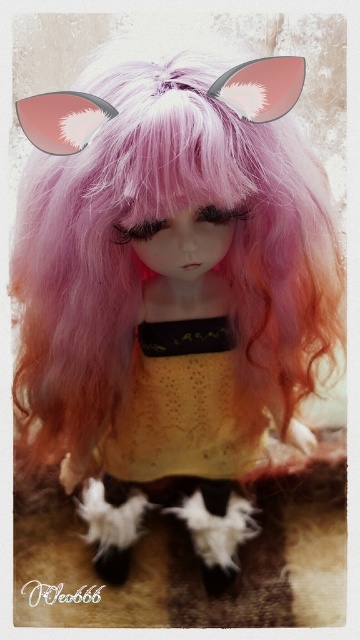
Question: Can you confirm if yellow lace dress at center is smaller than matte pink goggles at upper left?

Choices:
 (A) yes
 (B) no

Answer: (B)

Question: Which point appears closest to the camera in this image?

Choices:
 (A) (21, 113)
 (B) (212, 365)

Answer: (A)

Question: Is yellow lace dress at center to the right of pink matte goggles at upper center from the viewer's perspective?

Choices:
 (A) no
 (B) yes

Answer: (B)

Question: Does yellow lace dress at center have a larger size compared to pink matte goggles at upper center?

Choices:
 (A) yes
 (B) no

Answer: (A)

Question: Which object appears farthest from the camera in this image?

Choices:
 (A) pink matte goggles at upper center
 (B) matte pink goggles at upper left
 (C) yellow lace dress at center

Answer: (C)

Question: Based on their relative distances, which object is farther from the matte pink goggles at upper left?

Choices:
 (A) yellow lace dress at center
 (B) pink matte goggles at upper center

Answer: (A)